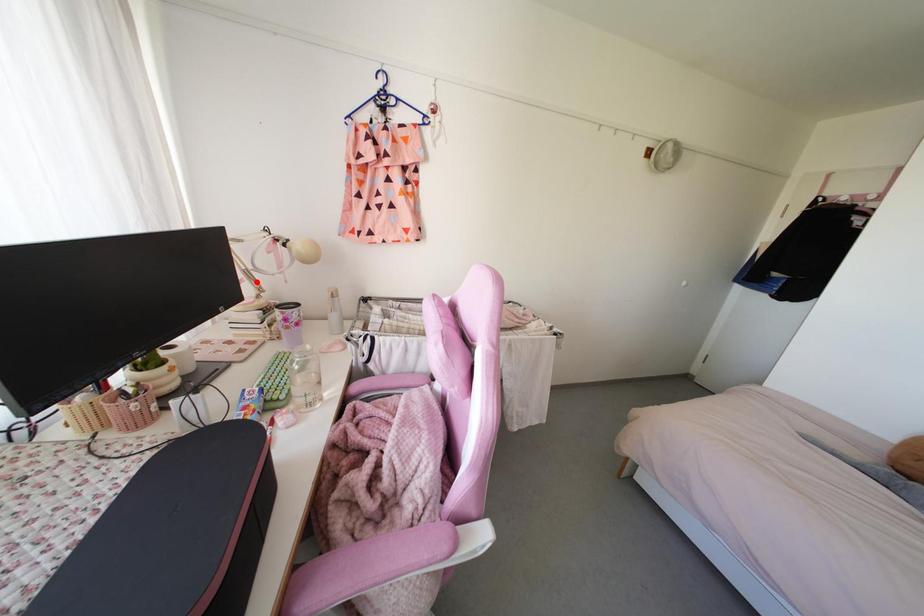
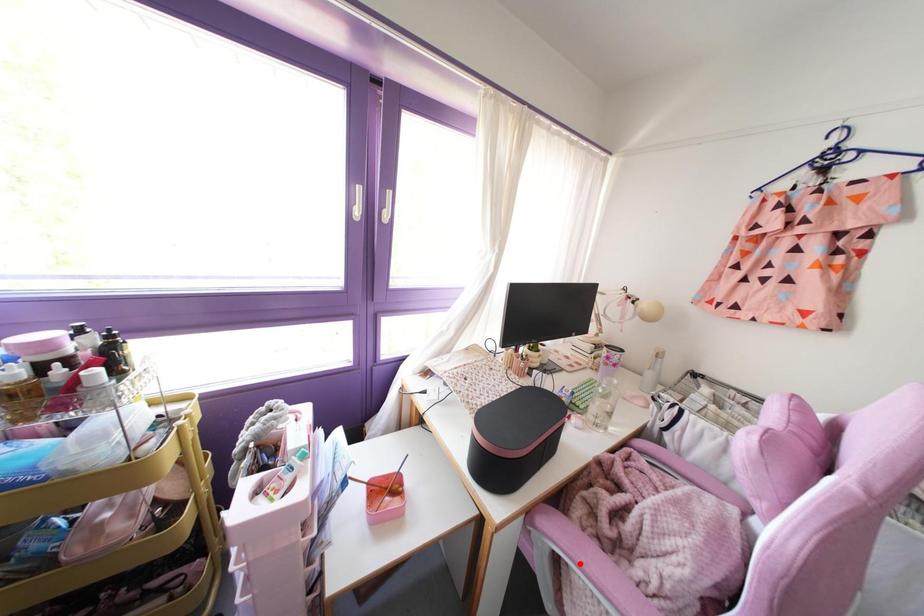
I am providing you with two images of the same scene from different viewpoints. A red point is marked on the first image and another point is marked on the second image. Does the point marked in image1 correspond to the same location as the one in image2?

No